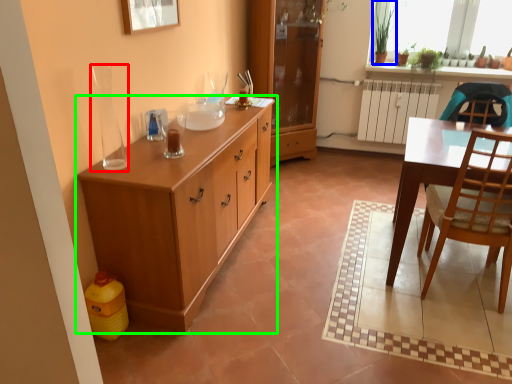
Question: Which object is positioned closest to vase (highlighted by a red box)? Select from houseplant (highlighted by a blue box) and cabinetry (highlighted by a green box).

Choices:
 (A) houseplant
 (B) cabinetry

Answer: (B)